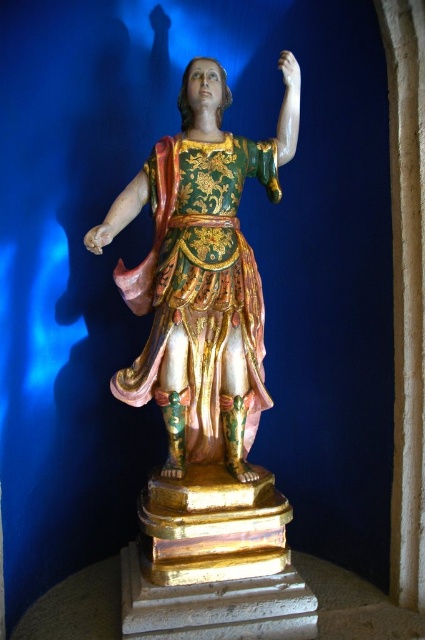
Between gilded wood statue at center and gold textured fabric robe at center, which one is positioned higher?

gold textured fabric robe at center

Is point (229, 250) positioned behind point (221, 173)?

No.

Between point (207, 154) and point (184, 218), which one is positioned behind?

Point (207, 154)

Image resolution: width=425 pixels, height=640 pixels. I want to click on gilded wood statue at center, so click(x=204, y=324).